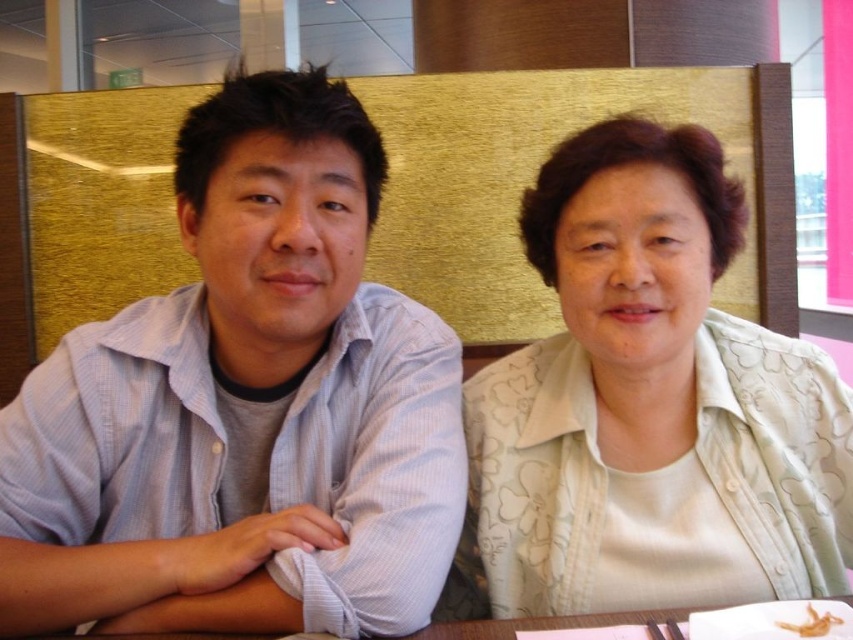
You are a photographer trying to capture a closeup of the light blue striped shirt at left. Given that the camera is currently focused on the center of the image, which direction should you adjust the focus to capture the shirt?

The light blue striped shirt at left is located at point 0.636 on the x axis and 0.287 on the y axis. Since the center of the image is at point 0.5 on both axes, the shirt is to the right and above the current focus. Adjust the focus towards the upper right direction to capture it.

You are a photographer setting up for a group photo. You need to ensure that all subjects are visible. Given that the light blue striped shirt at left and the light green floral blouse at center are in your frame, which one might you need to adjust your camera angle to better include?

The light blue striped shirt at left is larger in size than the light green floral blouse at center, so you might need to adjust your camera angle to better include the light blue striped shirt at left since it takes up more space in the frame.

Based on the coordinates provided, which object in the scene is located at point (244, 406)?

The light blue striped shirt at left is located at point (244, 406).